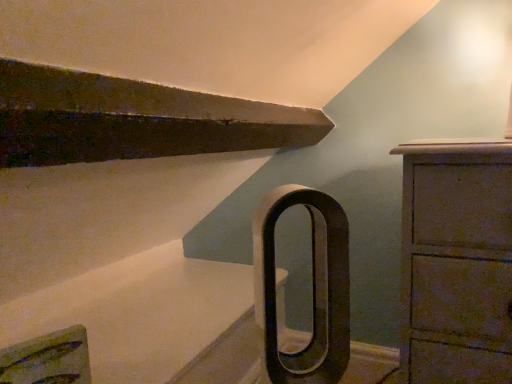
The height and width of the screenshot is (384, 512). Describe the element at coordinates (456, 263) in the screenshot. I see `wooden chest of drawers at right` at that location.

I want to click on wooden chest of drawers at right, so (456, 263).

What do you see at coordinates (313, 288) in the screenshot? This screenshot has height=384, width=512. I see `black matte door handle at center` at bounding box center [313, 288].

I want to click on black matte door handle at center, so click(313, 288).

Locate an element on the screen. This screenshot has width=512, height=384. wooden chest of drawers at right is located at coordinates (456, 263).

Can you confirm if wooden chest of drawers at right is positioned to the left of black matte door handle at center?

In fact, wooden chest of drawers at right is to the right of black matte door handle at center.

In the image, is wooden chest of drawers at right positioned in front of or behind black matte door handle at center?

Clearly, wooden chest of drawers at right is behind black matte door handle at center.

Which is closer to the camera, (404, 168) or (347, 294)?

Point (404, 168).

Based on the photo, from the image's perspective, is wooden chest of drawers at right over black matte door handle at center?

No, from the image's perspective, wooden chest of drawers at right is not over black matte door handle at center.

From a real-world perspective, which object rests below the other?

In real-world perspective, wooden chest of drawers at right is lower.

Which of these two, wooden chest of drawers at right or black matte door handle at center, is wider?

wooden chest of drawers at right.

Between wooden chest of drawers at right and black matte door handle at center, which one has more height?

Standing taller between the two is wooden chest of drawers at right.

Does wooden chest of drawers at right have a smaller size compared to black matte door handle at center?

Incorrect, wooden chest of drawers at right is not smaller in size than black matte door handle at center.

Is wooden chest of drawers at right not inside black matte door handle at center?

Indeed, wooden chest of drawers at right is completely outside black matte door handle at center.

Would you consider wooden chest of drawers at right to be distant from black matte door handle at center?

No, wooden chest of drawers at right is in close proximity to black matte door handle at center.

Is wooden chest of drawers at right facing towards black matte door handle at center?

No, wooden chest of drawers at right is not oriented towards black matte door handle at center.

Image resolution: width=512 pixels, height=384 pixels. What are the coordinates of `door handle that appears on the left of wooden chest of drawers at right` in the screenshot? It's located at (313, 288).

Between black matte door handle at center and wooden chest of drawers at right, which one appears on the left side from the viewer's perspective?

From the viewer's perspective, black matte door handle at center appears more on the left side.

Does black matte door handle at center lie in front of wooden chest of drawers at right?

Yes, the depth of black matte door handle at center is less than that of wooden chest of drawers at right.

Is point (342, 268) closer to viewer compared to point (458, 268)?

Yes, it is.

Based on the photo, from the image's perspective, would you say black matte door handle at center is shown under wooden chest of drawers at right?

No, from the image's perspective, black matte door handle at center is not beneath wooden chest of drawers at right.

From a real-world perspective, is black matte door handle at center located higher than wooden chest of drawers at right?

Yes, from a real-world perspective, black matte door handle at center is above wooden chest of drawers at right.

Which object is wider, black matte door handle at center or wooden chest of drawers at right?

wooden chest of drawers at right is wider.

Considering the sizes of objects black matte door handle at center and wooden chest of drawers at right in the image provided, who is taller, black matte door handle at center or wooden chest of drawers at right?

Standing taller between the two is wooden chest of drawers at right.

Considering the sizes of objects black matte door handle at center and wooden chest of drawers at right in the image provided, who is smaller, black matte door handle at center or wooden chest of drawers at right?

Smaller between the two is black matte door handle at center.

Can wooden chest of drawers at right be found inside black matte door handle at center?

No.

Is black matte door handle at center positioned far away from wooden chest of drawers at right?

They are positioned close to each other.

Could you tell me if black matte door handle at center is facing wooden chest of drawers at right?

No, black matte door handle at center is not facing towards wooden chest of drawers at right.

The width and height of the screenshot is (512, 384). In order to click on chest of drawers below the black matte door handle at center (from a real-world perspective) in this screenshot , I will do `click(456, 263)`.

You are a GUI agent. You are given a task and a screenshot of the screen. Output one action in this format:
    pyautogui.click(x=<x>, y=<y>)
    Task: Click on the door handle above the wooden chest of drawers at right (from the image's perspective)
    
    Given the screenshot: What is the action you would take?
    pyautogui.click(x=313, y=288)

You are a GUI agent. You are given a task and a screenshot of the screen. Output one action in this format:
    pyautogui.click(x=<x>, y=<y>)
    Task: Click on the chest of drawers behind the black matte door handle at center
    
    Given the screenshot: What is the action you would take?
    pyautogui.click(x=456, y=263)